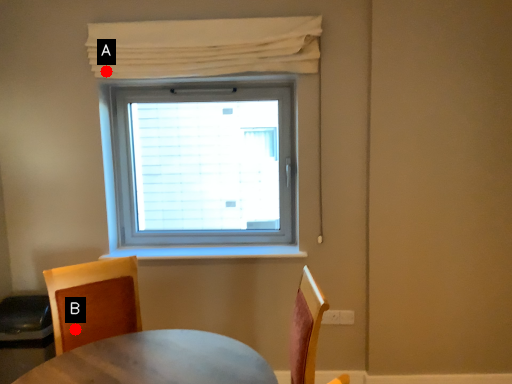
Question: Two points are circled on the image, labeled by A and B beside each circle. Which point appears closest to the camera in this image?

Choices:
 (A) A is closer
 (B) B is closer

Answer: (B)